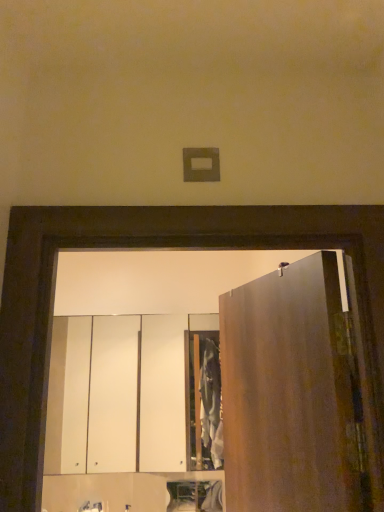
Question: From their relative heights in the image, would you say white glossy cabinet at lower center, the 2th cabinetry positioned from the top, is taller or shorter than white glossy cabinet at center, positioned as the 2th cabinetry in bottom-to-top order?

Choices:
 (A) tall
 (B) short

Answer: (B)

Question: In terms of size, does white glossy cabinet at lower center, the 2th cabinetry positioned from the top, appear bigger or smaller than white glossy cabinet at center, positioned as the 2th cabinetry in bottom-to-top order?

Choices:
 (A) small
 (B) big

Answer: (A)

Question: Which of these objects is positioned closest to the matte silver faucet at lower center?

Choices:
 (A) matte brown door at right
 (B) white glossy cabinet at lower center, the 1th cabinetry positioned from the bottom
 (C) white glossy cabinet at center, arranged as the 1th cabinetry when viewed from the top

Answer: (B)

Question: Based on their relative distances, which object is nearer to the matte brown door at right?

Choices:
 (A) white glossy cabinet at lower center, the 2th cabinetry positioned from the top
 (B) matte silver faucet at lower center
 (C) white glossy cabinet at center, arranged as the 1th cabinetry when viewed from the top

Answer: (A)